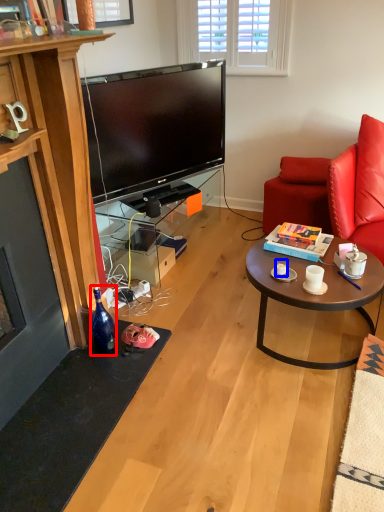
Question: Among these objects, which one is nearest to the camera, bottle (highlighted by a red box) or coffee cup (highlighted by a blue box)?

Choices:
 (A) bottle
 (B) coffee cup

Answer: (A)